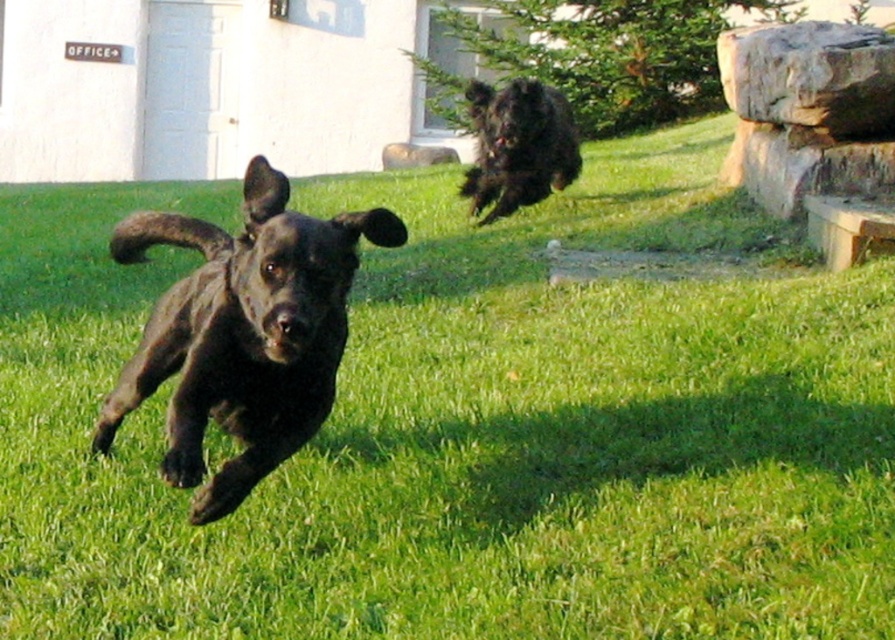
In the scene shown: Does shiny black dog at center have a lesser width compared to shaggy black dog at upper right?

In fact, shiny black dog at center might be wider than shaggy black dog at upper right.

Can you confirm if shiny black dog at center is positioned above shaggy black dog at upper right?

Incorrect, shiny black dog at center is not positioned above shaggy black dog at upper right.

Locate an element on the screen. This screenshot has height=640, width=895. shiny black dog at center is located at coordinates (243, 333).